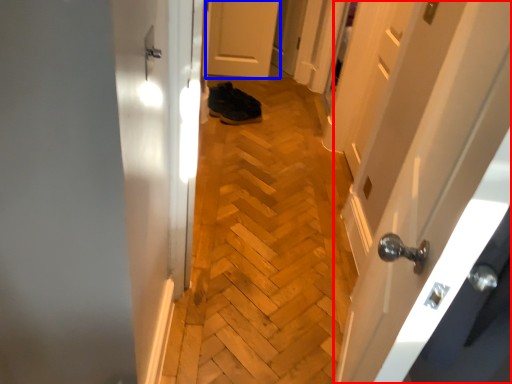
Question: Which object is further to the camera taking this photo, door (highlighted by a red box) or door (highlighted by a blue box)?

Choices:
 (A) door
 (B) door

Answer: (B)